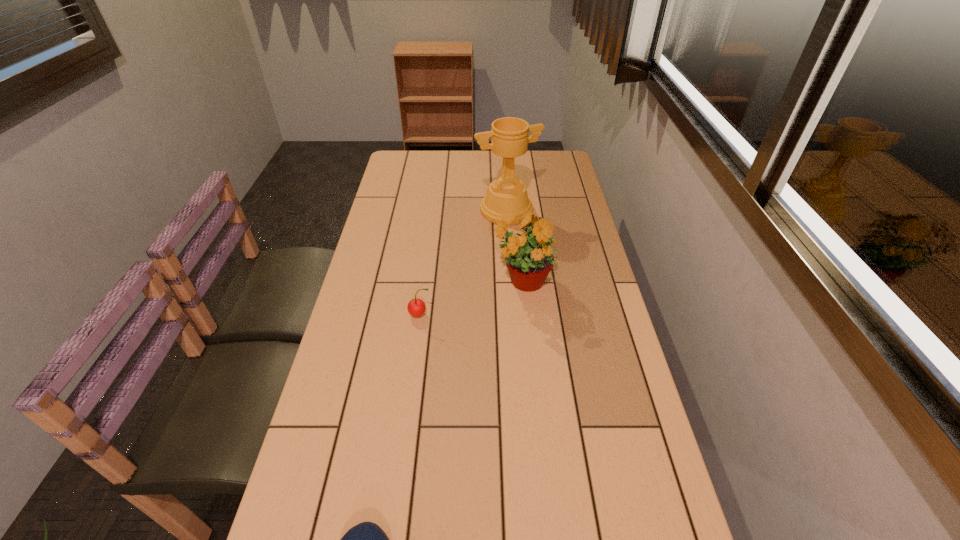
Locate an element on the screen. The width and height of the screenshot is (960, 540). vacant space at the far edge of the desktop is located at coordinates (440, 178).

Find the location of a particular element. vacant space at the left edge of the desktop is located at coordinates (370, 232).

I want to click on blank space at the right edge of the desktop, so click(x=536, y=188).

Locate an element on the screen. Image resolution: width=960 pixels, height=540 pixels. vacant space at the far left corner is located at coordinates (400, 168).

Identify the location of vacant space at the far right corner of the desktop. (544, 165).

At what (x,y) coordinates should I click in order to perform the action: click on free space between the cherry and the tallest object. Please return your answer as a coordinate pair (x, y). The image size is (960, 540). Looking at the image, I should click on click(463, 262).

Locate an element on the screen. The image size is (960, 540). free space that is in between the farthest object and the second nearest object is located at coordinates (463, 262).

Where is `vacant area that lies between the third shortest object and the third tallest object`? The height and width of the screenshot is (540, 960). vacant area that lies between the third shortest object and the third tallest object is located at coordinates (471, 299).

Identify which object is the closest to the flowerpot. Please provide its 2D coordinates. Your answer should be formatted as a tuple, i.e. [(x, y)], where the tuple contains the x and y coordinates of a point satisfying the conditions above.

[(416, 307)]

The height and width of the screenshot is (540, 960). Find the location of `object that can be found as the third closest to the flowerpot`. object that can be found as the third closest to the flowerpot is located at coordinates (x=366, y=539).